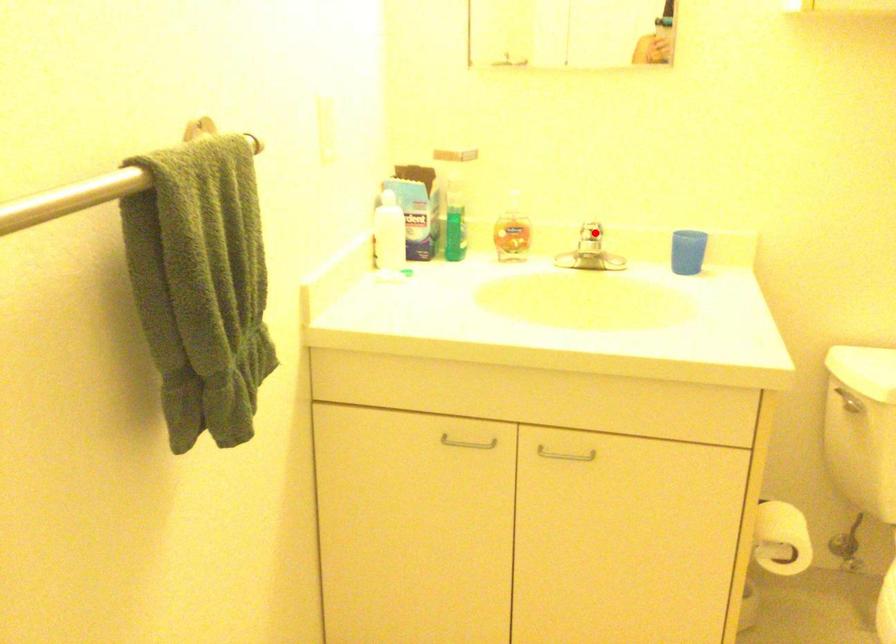
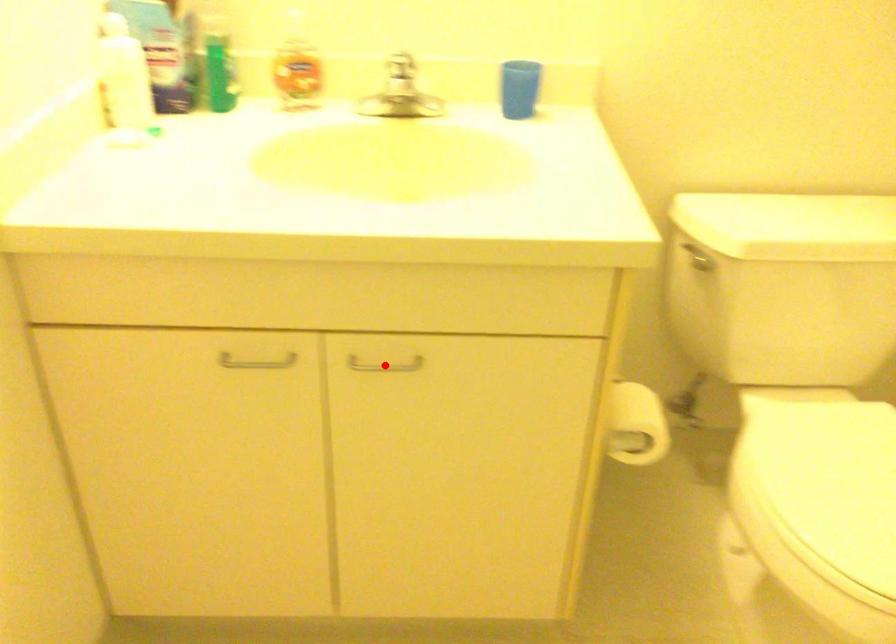
I am providing you with two images of the same scene from different viewpoints. A red point is marked on the first image and another point is marked on the second image. Does the point marked in image1 correspond to the same location as the one in image2?

No